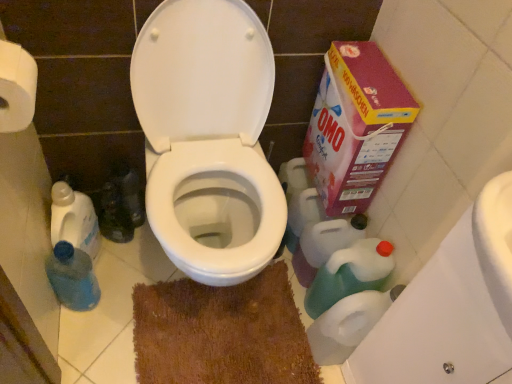
Question: Based on their sizes in the image, would you say brown textured bath mat at center is bigger or smaller than blue plastic bottle at lower left, placed as the second cleaning product when sorted from right to left?

Choices:
 (A) small
 (B) big

Answer: (B)

Question: Visually, is brown textured bath mat at center positioned to the left or to the right of blue plastic bottle at lower left, placed as the second cleaning product when sorted from right to left?

Choices:
 (A) right
 (B) left

Answer: (A)

Question: Which of these objects is positioned closest to the white glossy toilet at center?

Choices:
 (A) maroon cardboard box at right
 (B) white paper towel at upper left, marked as the 1th toilet paper in a left-to-right arrangement
 (C) translucent plastic bottle at lower left, the 1th cleaning product in the left-to-right sequence
 (D) green plastic bottle at lower right, which appears as the 3th cleaning product when viewed from the left
 (E) blue plastic bottle at lower left, placed as the second cleaning product when sorted from right to left

Answer: (A)

Question: Estimate the real-world distances between objects in this image. Which object is farther from the white plastic toilet paper at lower right, which is the 1th toilet paper in bottom-to-top order?

Choices:
 (A) maroon cardboard box at right
 (B) white glossy toilet at center
 (C) green plastic bottle at lower right, which appears as the 3th cleaning product when viewed from the left
 (D) white paper towel at upper left, marked as the 2th toilet paper in a right-to-left arrangement
 (E) blue plastic bottle at lower left, placed as the second cleaning product when sorted from right to left

Answer: (D)